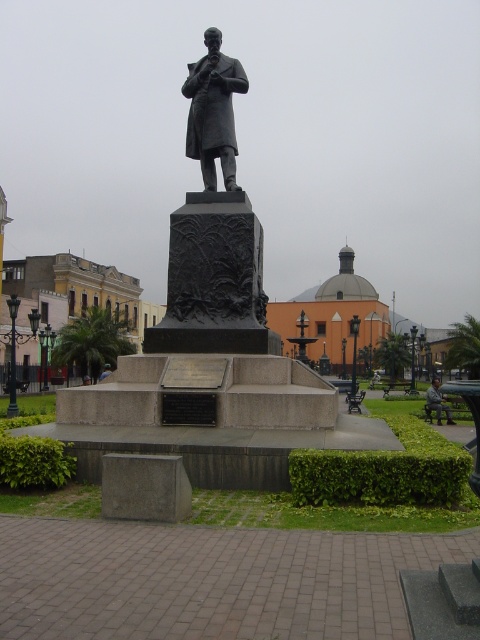
Question: Which object is closer to the camera taking this photo?

Choices:
 (A) bronze statue at center
 (B) polished bronze statue at center

Answer: (B)

Question: Does polished bronze statue at center appear on the right side of bronze statue at center?

Choices:
 (A) no
 (B) yes

Answer: (B)

Question: Estimate the real-world distances between objects in this image. Which object is closer to the polished bronze statue at center?

Choices:
 (A) camouflage fabric jacket at lower right
 (B) bronze statue at center

Answer: (B)

Question: Can you confirm if polished bronze statue at center is thinner than camouflage fabric jacket at lower right?

Choices:
 (A) no
 (B) yes

Answer: (B)

Question: Estimate the real-world distances between objects in this image. Which object is closer to the camouflage fabric jacket at lower right?

Choices:
 (A) polished bronze statue at center
 (B) bronze statue at center

Answer: (A)

Question: Can you confirm if polished bronze statue at center is positioned above camouflage fabric jacket at lower right?

Choices:
 (A) no
 (B) yes

Answer: (B)